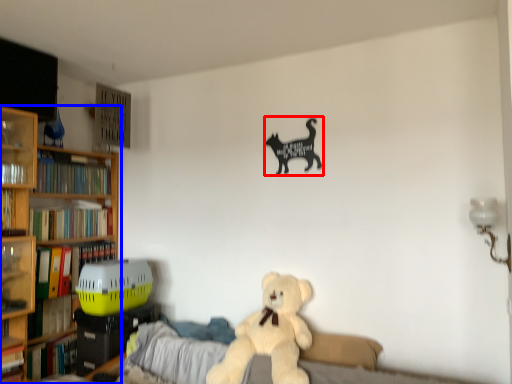
Question: Which point is closer to the camera, animal (highlighted by a red box) or bookcase (highlighted by a blue box)?

Choices:
 (A) animal
 (B) bookcase

Answer: (A)